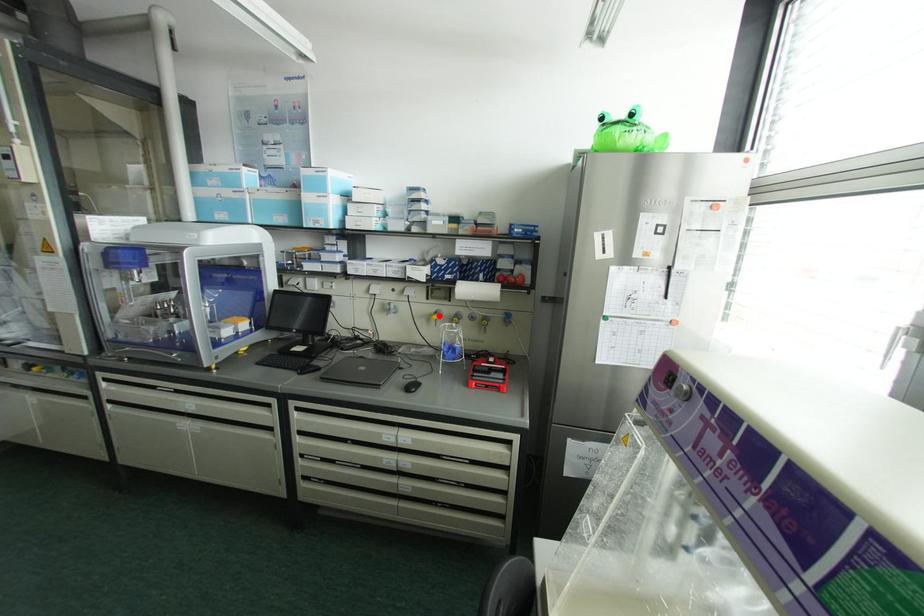
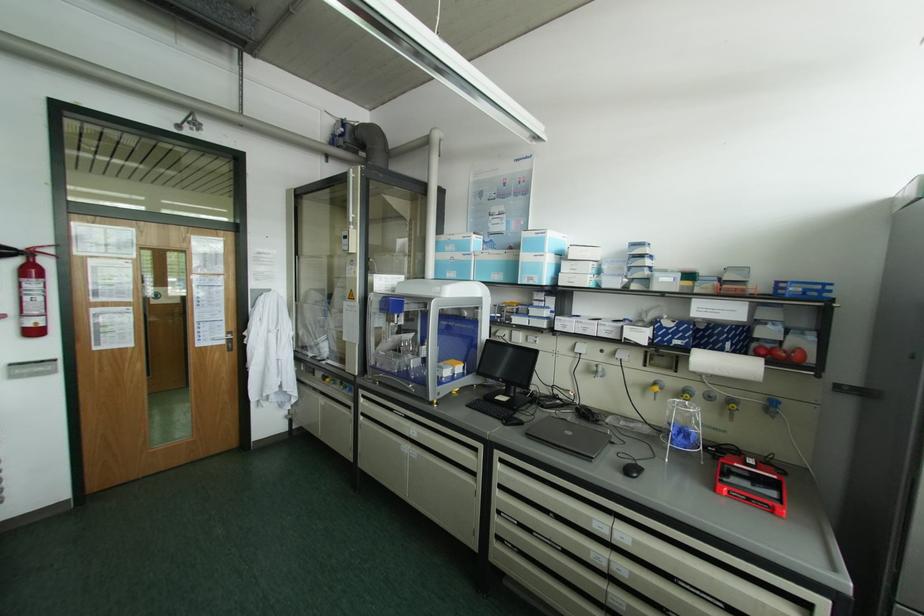
In the second image, find the point that corresponds to the highlighted location in the first image.

(660, 387)